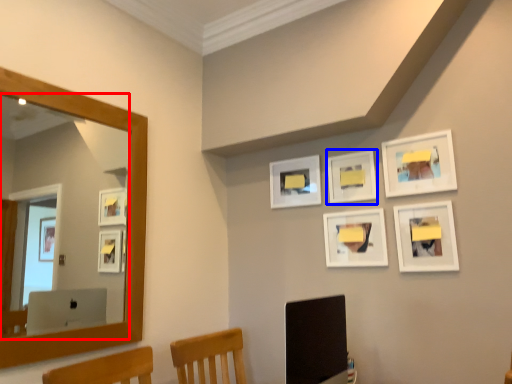
Question: Which of the following is the closest to the observer, mirror (highlighted by a red box) or picture frame (highlighted by a blue box)?

Choices:
 (A) mirror
 (B) picture frame

Answer: (A)